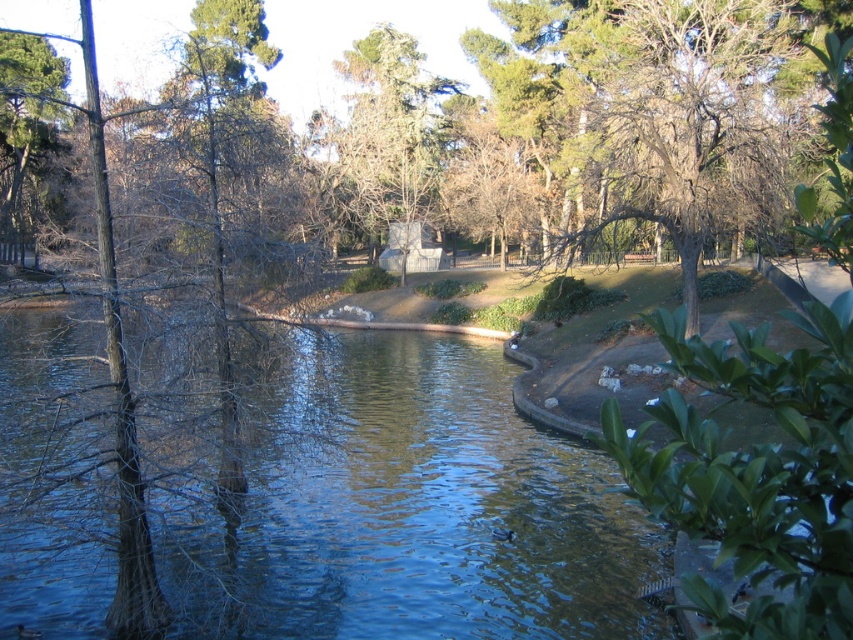
Question: Is green leafy tree at center to the right of green matte tree at upper left from the viewer's perspective?

Choices:
 (A) no
 (B) yes

Answer: (B)

Question: Which point is closer to the camera taking this photo?

Choices:
 (A) (9, 216)
 (B) (404, 58)
 (C) (722, 157)

Answer: (C)

Question: Does brown/dry bark tree at upper right appear on the right side of green leafy tree at center?

Choices:
 (A) no
 (B) yes

Answer: (B)

Question: Can you confirm if green leafy tree at center is bigger than green matte tree at upper left?

Choices:
 (A) no
 (B) yes

Answer: (A)

Question: Among these points, which one is farthest from the camera?

Choices:
 (A) tap(622, 141)
 (B) tap(347, 589)
 (C) tap(13, 113)
 (D) tap(399, 200)

Answer: (D)

Question: Which object appears closest to the camera in this image?

Choices:
 (A) brown/dry bark tree at upper right
 (B) green matte tree at upper left
 (C) green leafy tree at center
 (D) blue water at center

Answer: (D)